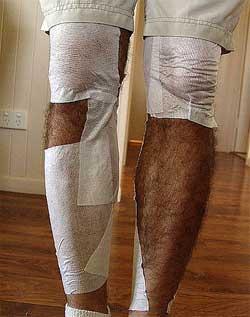
Identify the location of door. (139, 115), (225, 107).